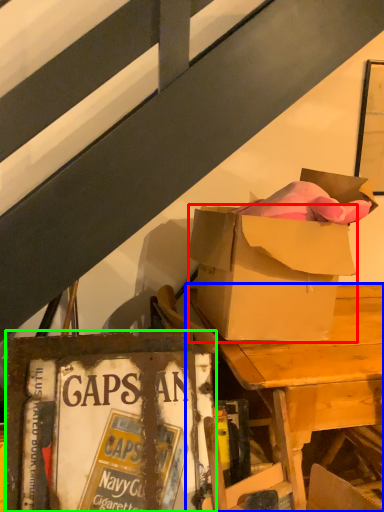
Question: Considering the real-world distances, which object is farthest from box (highlighted by a red box)? desk (highlighted by a blue box) or paperback book (highlighted by a green box)?

Choices:
 (A) desk
 (B) paperback book

Answer: (B)